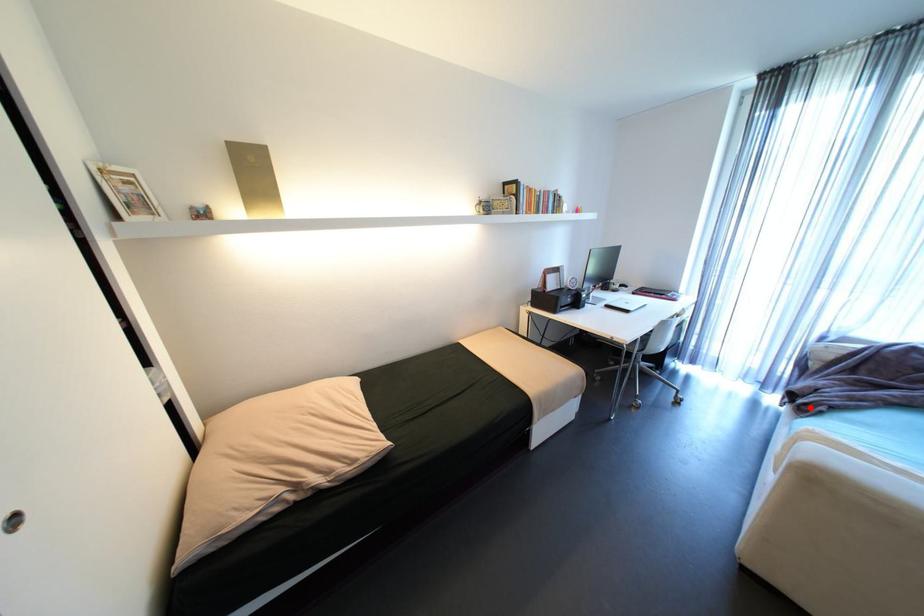
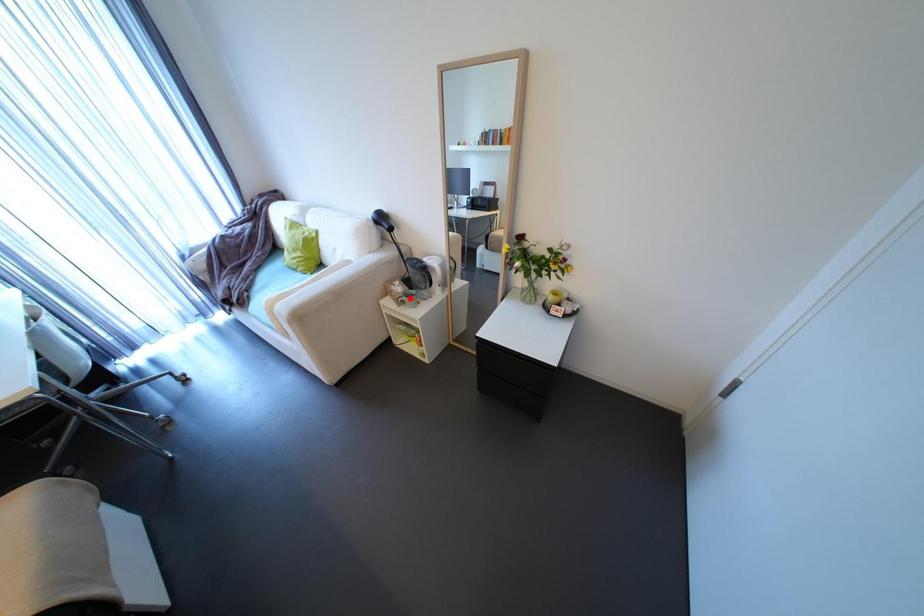
I am providing you with two images of the same scene from different viewpoints. A red point is marked on the first image and another point is marked on the second image. Is the marked point in image1 the same physical position as the marked point in image2?

No